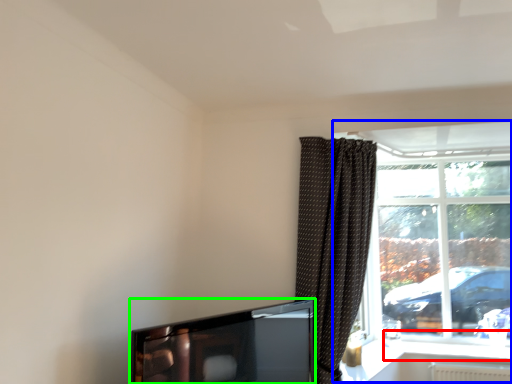
Question: Which object is the farthest from window sill (highlighted by a red box)? Choose among these: window (highlighted by a blue box) or television (highlighted by a green box).

Choices:
 (A) window
 (B) television

Answer: (B)